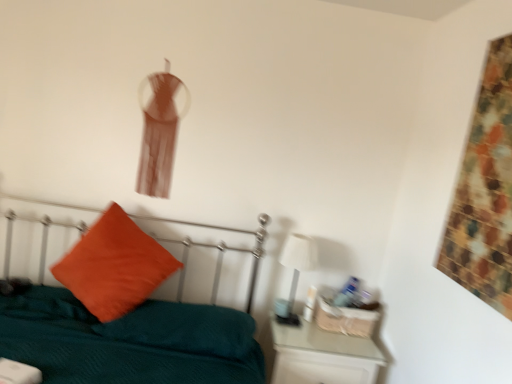
The height and width of the screenshot is (384, 512). What do you see at coordinates (129, 341) in the screenshot?
I see `teal fabric bed at center` at bounding box center [129, 341].

You are a GUI agent. You are given a task and a screenshot of the screen. Output one action in this format:
    pyautogui.click(x=<x>, y=<y>)
    Task: Click on the teal fabric bed at center
    
    Given the screenshot: What is the action you would take?
    pyautogui.click(x=129, y=341)

Where is `white glossy nightstand at lower right`? white glossy nightstand at lower right is located at coordinates (322, 356).

Locate an element on the screen. The height and width of the screenshot is (384, 512). pillow lying on the left of white glossy nightstand at lower right is located at coordinates (114, 266).

Are white glossy nightstand at lower right and orange velvet pillow at left making contact?

They are not placed beside each other.

Based on the photo, measure the distance between white glossy nightstand at lower right and orange velvet pillow at left.

They are 33.08 inches apart.

Is white glossy nightstand at lower right facing towards orange velvet pillow at left?

No, white glossy nightstand at lower right is not facing towards orange velvet pillow at left.

Does white glossy nightstand at lower right come in front of white glossy table lamp at right?

Yes, white glossy nightstand at lower right is closer to the camera.

Considering the points (334, 366) and (291, 299), which point is behind, point (334, 366) or point (291, 299)?

The point (291, 299) is behind.

Is white glossy nightstand at lower right to the right of white glossy table lamp at right from the viewer's perspective?

Yes.

From the picture: From a real-world perspective, relative to white glossy table lamp at right, is white glossy nightstand at lower right vertically above or below?

white glossy nightstand at lower right is below white glossy table lamp at right.

Does orange velvet pillow at left have a smaller size compared to teal fabric bed at center?

Yes, orange velvet pillow at left is smaller than teal fabric bed at center.

How many degrees apart are the facing directions of orange velvet pillow at left and teal fabric bed at center?

orange velvet pillow at left and teal fabric bed at center are facing 14.1 degrees away from each other.

From a real-world perspective, is orange velvet pillow at left under teal fabric bed at center?

No.

Considering the points (21, 349) and (312, 255), which point is in front, point (21, 349) or point (312, 255)?

Positioned in front is point (21, 349).

Is white glossy table lamp at right at the back of teal fabric bed at center?

No.

Relative to white glossy table lamp at right, is teal fabric bed at center in front or behind?

Clearly, teal fabric bed at center is in front of white glossy table lamp at right.

Is teal fabric bed at center bigger or smaller than white glossy table lamp at right?

In the image, teal fabric bed at center appears to be larger than white glossy table lamp at right.

Who is taller, white glossy table lamp at right or teal fabric bed at center?

teal fabric bed at center is taller.

From a real-world perspective, is white glossy table lamp at right physically below teal fabric bed at center?

Incorrect, from a real-world perspective, white glossy table lamp at right is higher than teal fabric bed at center.

Is white glossy table lamp at right completely or partially outside of teal fabric bed at center?

That's correct, white glossy table lamp at right is outside of teal fabric bed at center.

Based on the photo, from a real-world perspective, is white glossy table lamp at right positioned above or below orange velvet pillow at left?

white glossy table lamp at right is above orange velvet pillow at left.

Is white glossy table lamp at right at the right side of orange velvet pillow at left?

Indeed, white glossy table lamp at right is positioned on the right side of orange velvet pillow at left.

In the scene shown: Which object is further away from the camera, white glossy table lamp at right or orange velvet pillow at left?

white glossy table lamp at right is behind.

Based on the photo, in terms of height, does white glossy table lamp at right look taller or shorter compared to orange velvet pillow at left?

Clearly, white glossy table lamp at right is shorter compared to orange velvet pillow at left.

Between teal fabric bed at center and orange velvet pillow at left, which one has smaller size?

With smaller size is orange velvet pillow at left.

From a real-world perspective, is teal fabric bed at center on top of orange velvet pillow at left?

No, from a real-world perspective, teal fabric bed at center is not above orange velvet pillow at left.

Considering the relative sizes of teal fabric bed at center and orange velvet pillow at left in the image provided, is teal fabric bed at center wider than orange velvet pillow at left?

Correct, the width of teal fabric bed at center exceeds that of orange velvet pillow at left.

How many degrees apart are the facing directions of teal fabric bed at center and orange velvet pillow at left?

The angular difference between teal fabric bed at center and orange velvet pillow at left is 14.1 degrees.

Locate an element on the screen. pillow positioned vertically above the white glossy nightstand at lower right (from a real-world perspective) is located at coordinates (114, 266).

The image size is (512, 384). Find the location of `nightstand on the right of the white glossy table lamp at right`. nightstand on the right of the white glossy table lamp at right is located at coordinates (322, 356).

Looking at the image, which one is located further to teal fabric bed at center, white glossy nightstand at lower right or white glossy table lamp at right?

white glossy table lamp at right is further to teal fabric bed at center.

Considering their positions, is orange velvet pillow at left positioned further to white glossy nightstand at lower right than teal fabric bed at center?

Among the two, orange velvet pillow at left is located further to white glossy nightstand at lower right.

In the scene shown: Which object lies nearer to the anchor point white glossy table lamp at right, white glossy nightstand at lower right or orange velvet pillow at left?

The object closer to white glossy table lamp at right is white glossy nightstand at lower right.

Based on their spatial positions, is white glossy table lamp at right or teal fabric bed at center closer to orange velvet pillow at left?

teal fabric bed at center.

Based on their spatial positions, is white glossy table lamp at right or teal fabric bed at center closer to white glossy nightstand at lower right?

white glossy table lamp at right is positioned closer to the anchor white glossy nightstand at lower right.

Considering their positions, is teal fabric bed at center positioned further to white glossy table lamp at right than orange velvet pillow at left?

The object further to white glossy table lamp at right is orange velvet pillow at left.

When comparing their distances from teal fabric bed at center, does white glossy table lamp at right or orange velvet pillow at left seem further?

white glossy table lamp at right.

Which object lies further to the anchor point white glossy table lamp at right, orange velvet pillow at left or teal fabric bed at center?

orange velvet pillow at left lies further to white glossy table lamp at right than the other object.

Identify the location of pillow between teal fabric bed at center and white glossy table lamp at right from front to back. (114, 266).

Locate an element on the screen. This screenshot has width=512, height=384. nightstand positioned between teal fabric bed at center and white glossy table lamp at right from near to far is located at coordinates (322, 356).

Locate an element on the screen. table lamp between orange velvet pillow at left and white glossy nightstand at lower right in the horizontal direction is located at coordinates (296, 269).

Where is `pillow between teal fabric bed at center and white glossy nightstand at lower right along the z-axis`? This screenshot has height=384, width=512. pillow between teal fabric bed at center and white glossy nightstand at lower right along the z-axis is located at coordinates (114, 266).